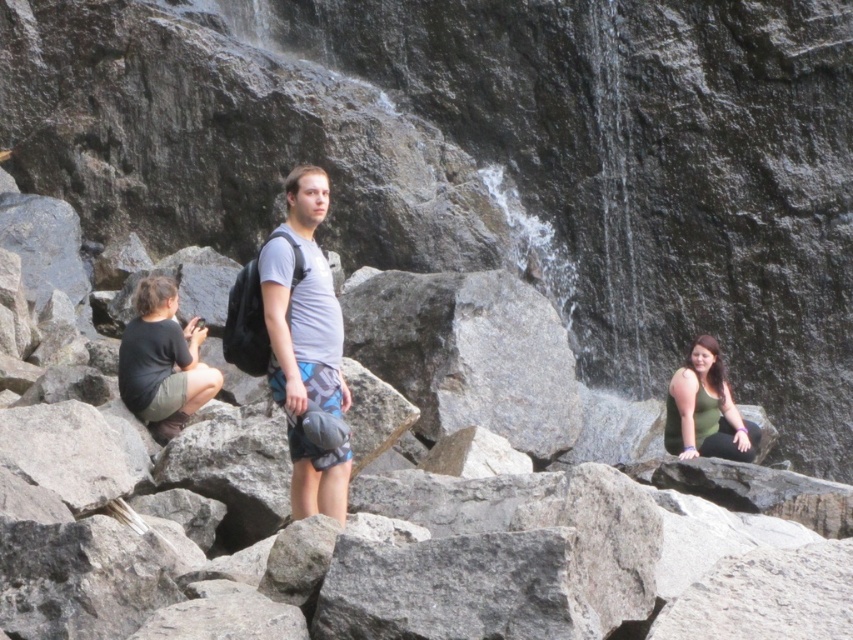
Question: Is black fabric at left closer to the viewer compared to green matte tank top at lower right?

Choices:
 (A) no
 (B) yes

Answer: (B)

Question: Is gray fabric backpack at center to the left of green matte tank top at lower right from the viewer's perspective?

Choices:
 (A) yes
 (B) no

Answer: (A)

Question: Can you confirm if gray fabric backpack at center is positioned above green matte tank top at lower right?

Choices:
 (A) yes
 (B) no

Answer: (A)

Question: Which object is the farthest from the black fabric at left?

Choices:
 (A) green matte tank top at lower right
 (B) gray fabric backpack at center

Answer: (A)

Question: Which object is closer to the camera taking this photo?

Choices:
 (A) gray fabric backpack at center
 (B) black fabric at left

Answer: (A)

Question: Which of the following is the closest to the observer?

Choices:
 (A) green matte tank top at lower right
 (B) gray fabric backpack at center

Answer: (B)